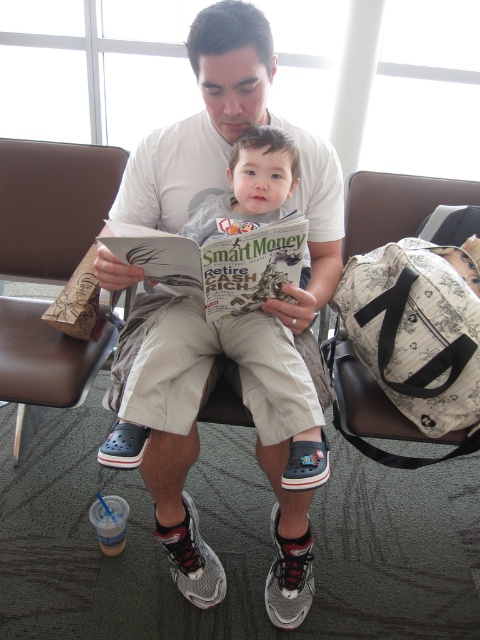
Question: Is the position of gray cotton shirt at center more distant than that of patterned fabric bag at right?

Choices:
 (A) yes
 (B) no

Answer: (B)

Question: Which object is closer to the camera taking this photo?

Choices:
 (A) gray cotton shirt at center
 (B) brown leather armchair at left

Answer: (A)

Question: Which object is closer to the camera taking this photo?

Choices:
 (A) gray cotton shirt at center
 (B) brown leather armchair at left

Answer: (A)

Question: Which point appears closest to the camera in this image?

Choices:
 (A) (24, 141)
 (B) (134, 403)

Answer: (B)

Question: Does gray cotton shirt at center have a greater width compared to patterned fabric bag at right?

Choices:
 (A) yes
 (B) no

Answer: (A)

Question: Is gray cotton shirt at center above brown leather armchair at left?

Choices:
 (A) no
 (B) yes

Answer: (A)